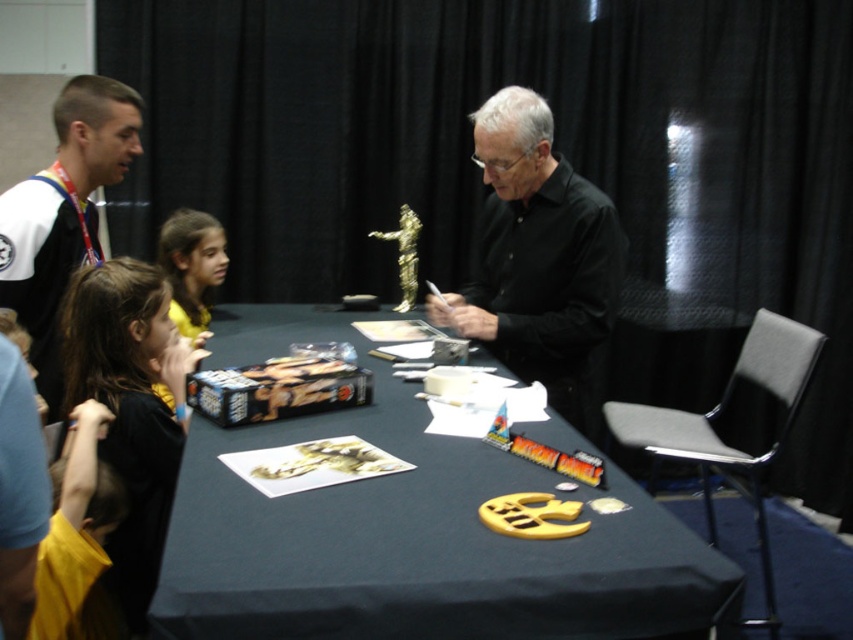
You are a photographer at the event and need to capture a photo of both the black matte shirt at center and the yellow fabric shirt at lower left. Which shirt should you focus on first to ensure both are in the frame?

The black matte shirt at center is positioned on the right side of yellow fabric shirt at lower left, so you should focus on the yellow fabric shirt at lower left first to ensure both are in the frame.

You are a photographer at the event and need to capture a photo of the matte black table at center and the black matte shirt at center. From the photographer perspective, which object is on the left side?

The matte black table at center is positioned on the left side of the black matte shirt at center, so from the photographer perspective, the matte black table at center is on the left side.